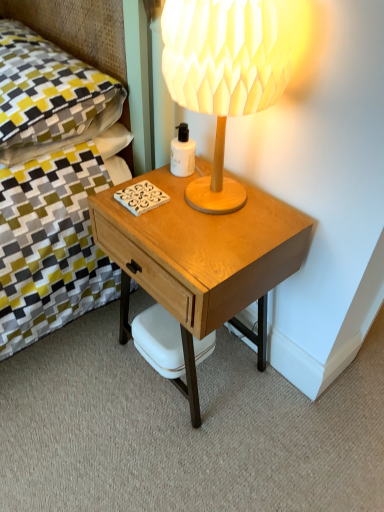
At what (x,y) coordinates should I click in order to perform the action: click on vacant space to the left of wooden lampshade at upper right. Please return your answer as a coordinate pair (x, y). The height and width of the screenshot is (512, 384). Looking at the image, I should click on (143, 202).